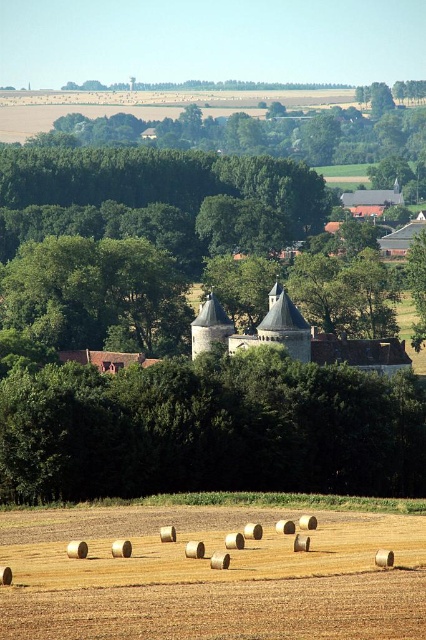
Where is `green leafy tree at center`? The height and width of the screenshot is (640, 426). green leafy tree at center is located at coordinates (210, 429).

At what (x,y) coordinates should I click in order to perform the action: click on green leafy tree at center. Please return your answer as a coordinate pair (x, y). Looking at the image, I should click on (210, 429).

Can you confirm if golden straw bales at lower center is taller than brown stone castle at center?

→ No.

Can you confirm if golden straw bales at lower center is thinner than brown stone castle at center?

Incorrect, golden straw bales at lower center's width is not less than brown stone castle at center's.

The height and width of the screenshot is (640, 426). I want to click on golden straw bales at lower center, so click(210, 577).

Can you confirm if green leafy tree at center is positioned above brown stone castle at center?

No.

Consider the image. Which is below, green leafy tree at center or brown stone castle at center?

green leafy tree at center is below.

Between point (109, 477) and point (386, 365), which one is positioned in front?

Point (109, 477)

Identify the location of green leafy tree at center. This screenshot has height=640, width=426. (210, 429).